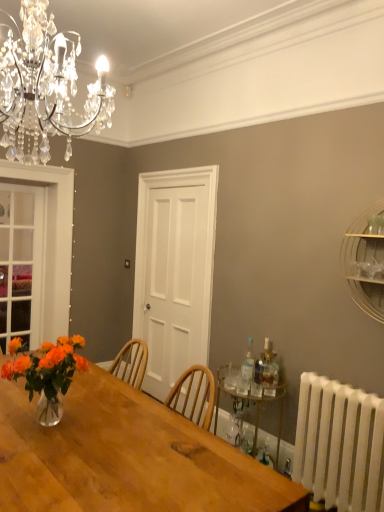
Question: From the image's perspective, is gold metallic bar cart at lower right, which ranks as the first shelf in left-to-right order, above white plastic radiator at lower right?

Choices:
 (A) yes
 (B) no

Answer: (A)

Question: Can we say gold metallic bar cart at lower right, placed as the 2th shelf when sorted from top to bottom, lies outside white plastic radiator at lower right?

Choices:
 (A) yes
 (B) no

Answer: (A)

Question: Can you confirm if gold metallic bar cart at lower right, acting as the second shelf starting from the right, is taller than white plastic radiator at lower right?

Choices:
 (A) yes
 (B) no

Answer: (B)

Question: Is gold metallic bar cart at lower right, acting as the second shelf starting from the right, oriented away from white plastic radiator at lower right?

Choices:
 (A) yes
 (B) no

Answer: (B)

Question: Does gold metallic bar cart at lower right, which ranks as the first shelf in left-to-right order, have a greater width compared to white plastic radiator at lower right?

Choices:
 (A) no
 (B) yes

Answer: (B)

Question: Relative to white plastic radiator at lower right, is clear glass door at left in front or behind?

Choices:
 (A) behind
 (B) front

Answer: (A)

Question: Does point (6, 262) appear closer or farther from the camera than point (321, 476)?

Choices:
 (A) farther
 (B) closer

Answer: (A)

Question: In terms of size, does clear glass door at left appear bigger or smaller than white plastic radiator at lower right?

Choices:
 (A) small
 (B) big

Answer: (A)

Question: Which is correct: clear glass door at left is inside white plastic radiator at lower right, or outside of it?

Choices:
 (A) outside
 (B) inside

Answer: (A)

Question: Considering their positions, is white wooden door at center located in front of or behind clear glass door at left?

Choices:
 (A) behind
 (B) front

Answer: (B)

Question: Is white wooden door at center taller or shorter than clear glass door at left?

Choices:
 (A) short
 (B) tall

Answer: (B)

Question: Considering the relative positions of white wooden door at center and clear glass door at left in the image provided, is white wooden door at center to the left or to the right of clear glass door at left?

Choices:
 (A) right
 (B) left

Answer: (A)

Question: Considering the positions of point (175, 343) and point (23, 296), is point (175, 343) closer or farther from the camera than point (23, 296)?

Choices:
 (A) closer
 (B) farther

Answer: (A)

Question: From a real-world perspective, is white wooden door at center physically located above or below translucent glass vase at table left?

Choices:
 (A) below
 (B) above

Answer: (B)

Question: Considering the positions of point (142, 281) and point (13, 348), is point (142, 281) closer or farther from the camera than point (13, 348)?

Choices:
 (A) farther
 (B) closer

Answer: (A)